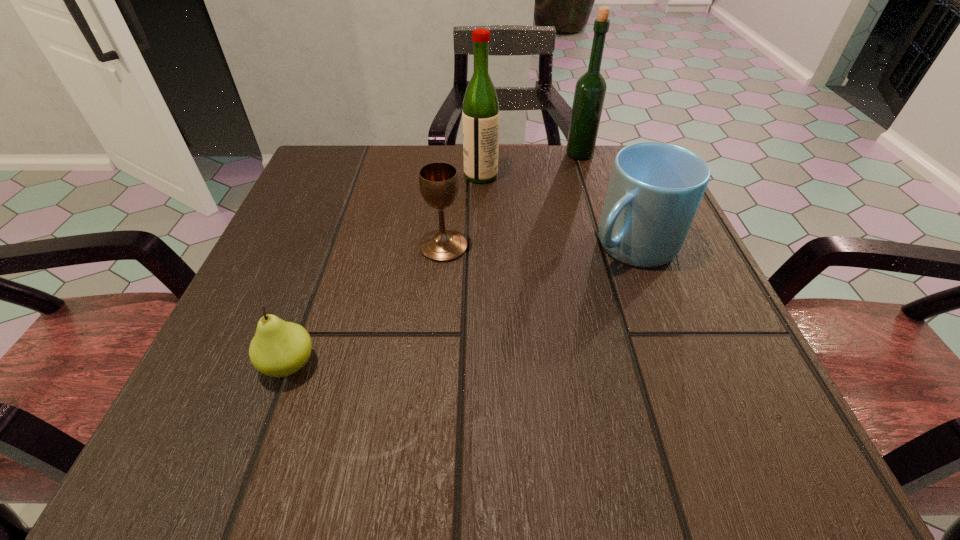
Where is `vacant space at the near edge of the desktop`? This screenshot has height=540, width=960. vacant space at the near edge of the desktop is located at coordinates (639, 457).

This screenshot has height=540, width=960. What are the coordinates of `vacant space at the left edge of the desktop` in the screenshot? It's located at (345, 244).

In the image, there is a desktop. Identify the location of free region at the right edge. This screenshot has height=540, width=960. (718, 313).

What are the coordinates of `vacant space at the far left corner of the desktop` in the screenshot? It's located at (356, 160).

I want to click on free space at the near left corner, so click(255, 437).

This screenshot has height=540, width=960. I want to click on vacant space at the far right corner, so click(x=604, y=188).

Where is `vacant space at the near right corner of the desktop`? This screenshot has height=540, width=960. vacant space at the near right corner of the desktop is located at coordinates (731, 452).

At what (x,y) coordinates should I click in order to perform the action: click on free space that is in between the nearer liquor and the pear. Please return your answer as a coordinate pair (x, y). Looking at the image, I should click on (385, 270).

At what (x,y) coordinates should I click in order to perform the action: click on free space between the nearer liquor and the chalice. Please return your answer as a coordinate pair (x, y). Looking at the image, I should click on (462, 211).

At what (x,y) coordinates should I click in order to perform the action: click on free spot between the chalice and the mug. Please return your answer as a coordinate pair (x, y). This screenshot has width=960, height=540. Looking at the image, I should click on (538, 246).